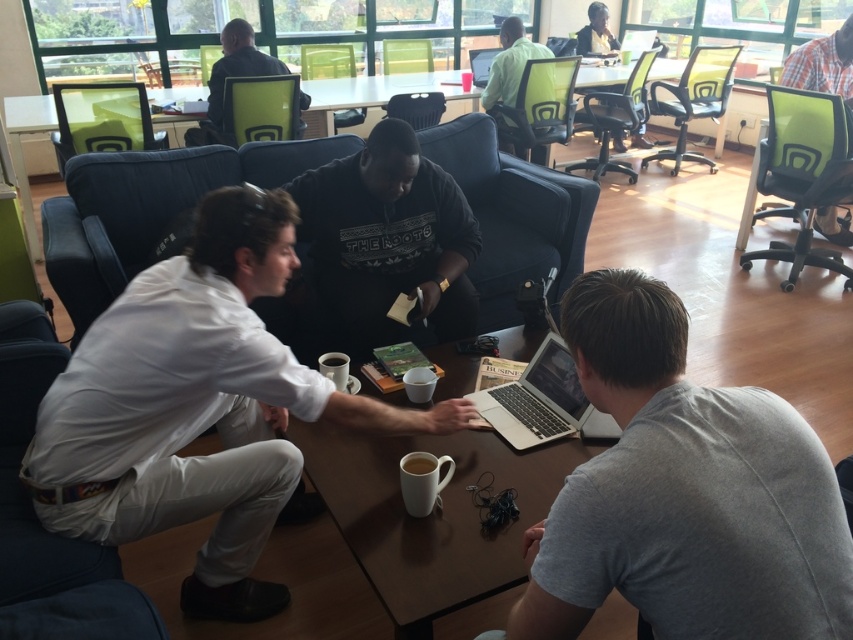
You are a delivery robot that is 1.2 meters wide. You need to move from the left side of the room to the right side. There is a silver metallic laptop at center on the table. Can you pass between the two people on the left and right sides without moving the laptop?

The two people are 1.76 meters apart, so yes, the robot can pass between them as the distance is wider than the robot.

You are standing in the office and want to reach the laptop at center. The point you are currently at is at coordinates point (537,397). Can you move directly to the laptop at center from your current position?

The point (537,397) is already on the silver metallic laptop at center, so you are already at the laptop.

You are sitting at the matte plastic table at center and want to reach the silver metallic laptop at center. Which direction should you move to get closer to the laptop?

The silver metallic laptop at center is to the right of the matte plastic table at center, so you should move to your right to get closer to the laptop.